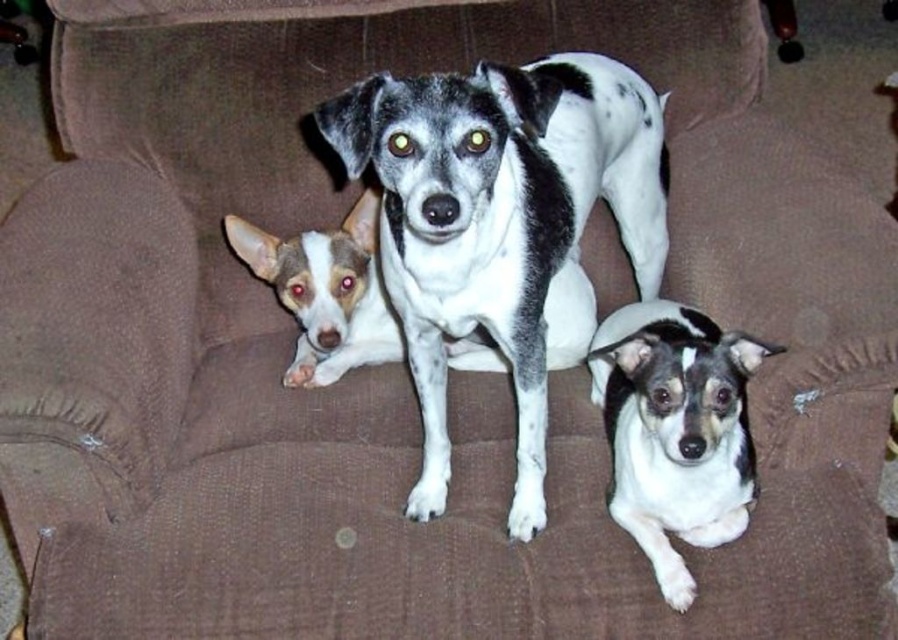
Does white and black fur dog at center have a greater width compared to white and gray fur dog at center?

Incorrect, white and black fur dog at center's width does not surpass white and gray fur dog at center's.

I want to click on white and black fur dog at center, so 676,429.

Find the location of a particular element. white and black fur dog at center is located at coordinates (676, 429).

Find the location of a particular element. white and black fur dog at center is located at coordinates (676, 429).

Is point (527, 84) less distant than point (647, 465)?

Yes, it is in front of point (647, 465).

Identify the location of white-spotted fur dog at center. The image size is (898, 640). (499, 220).

Which is more to the right, white-spotted fur dog at center or white and gray fur dog at center?

white-spotted fur dog at center

Is white-spotted fur dog at center to the left of white and gray fur dog at center from the viewer's perspective?

Incorrect, white-spotted fur dog at center is not on the left side of white and gray fur dog at center.

The image size is (898, 640). I want to click on white-spotted fur dog at center, so coord(499,220).